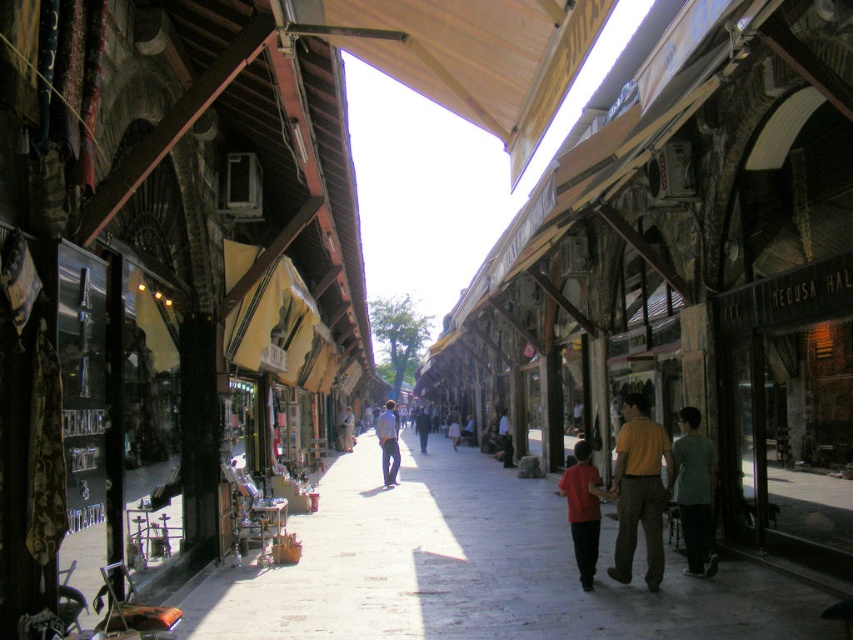
You are standing at the entrance of the market and want to find the orange cotton shirt at center. Based on the coordinates provided, in which direction should you walk to locate it?

The orange cotton shirt at center is located at coordinates 0.767 on the x axis and 0.750 on the y axis. Since you are at the entrance, which is likely at the start of the x axis, you should walk towards the right and slightly forward to reach the orange cotton shirt at center.